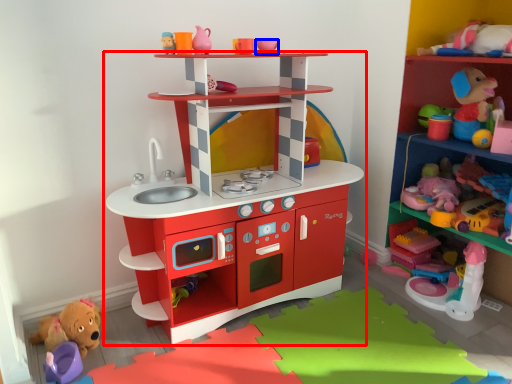
Question: Among these objects, which one is nearest to the camera, shelf (highlighted by a red box) or toy (highlighted by a blue box)?

Choices:
 (A) shelf
 (B) toy

Answer: (A)